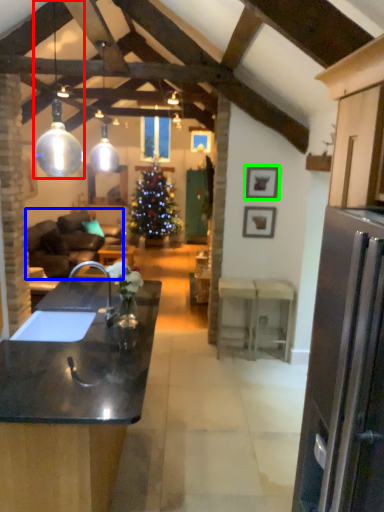
Question: Which object is positioned closest to lamp (highlighted by a red box)? Select from studio couch (highlighted by a blue box) and picture frame (highlighted by a green box).

Choices:
 (A) studio couch
 (B) picture frame

Answer: (A)